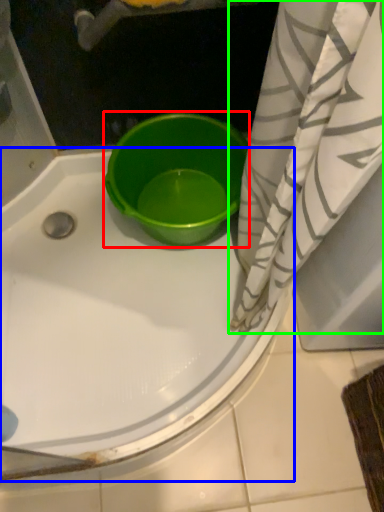
Question: Estimate the real-world distances between objects in this image. Which object is closer to basin (highlighted by a red box), bathtub (highlighted by a blue box) or curtain (highlighted by a green box)?

Choices:
 (A) bathtub
 (B) curtain

Answer: (A)